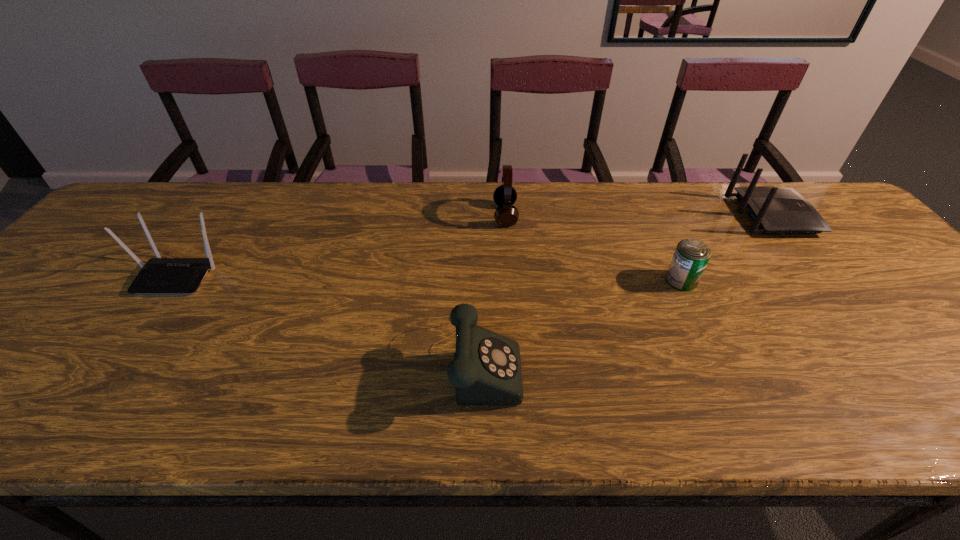
Locate an element on the screen. vacant point located 0.270m on the ear pads of the headset is located at coordinates (401, 215).

This screenshot has height=540, width=960. In order to click on free location located on the front-facing side of the farther router in this screenshot , I will do `click(825, 215)`.

At what (x,y) coordinates should I click in order to perform the action: click on vacant space located 0.200m on the front-facing side of the nearer router. Please return your answer as a coordinate pair (x, y). The width and height of the screenshot is (960, 540). Looking at the image, I should click on (113, 367).

Image resolution: width=960 pixels, height=540 pixels. Identify the location of vacant position located 0.370m on the dial of the telephone. (695, 360).

Identify the location of blank space located on the left of the fourth object from left to right. The width and height of the screenshot is (960, 540). (569, 280).

Where is `headset situated at the far edge`? headset situated at the far edge is located at coordinates (506, 215).

The width and height of the screenshot is (960, 540). What are the coordinates of `router that is at the far edge` in the screenshot? It's located at (774, 210).

The image size is (960, 540). Find the location of `object that is at the near edge`. object that is at the near edge is located at coordinates (486, 370).

You are a GUI agent. You are given a task and a screenshot of the screen. Output one action in this format:
    pyautogui.click(x=<x>, y=<y>)
    Task: Click on the object that is at the right edge
    
    Given the screenshot: What is the action you would take?
    pyautogui.click(x=774, y=210)

You are a GUI agent. You are given a task and a screenshot of the screen. Output one action in this format:
    pyautogui.click(x=<x>, y=<y>)
    Task: Click on the object that is at the far right corner
    
    Given the screenshot: What is the action you would take?
    pyautogui.click(x=774, y=210)